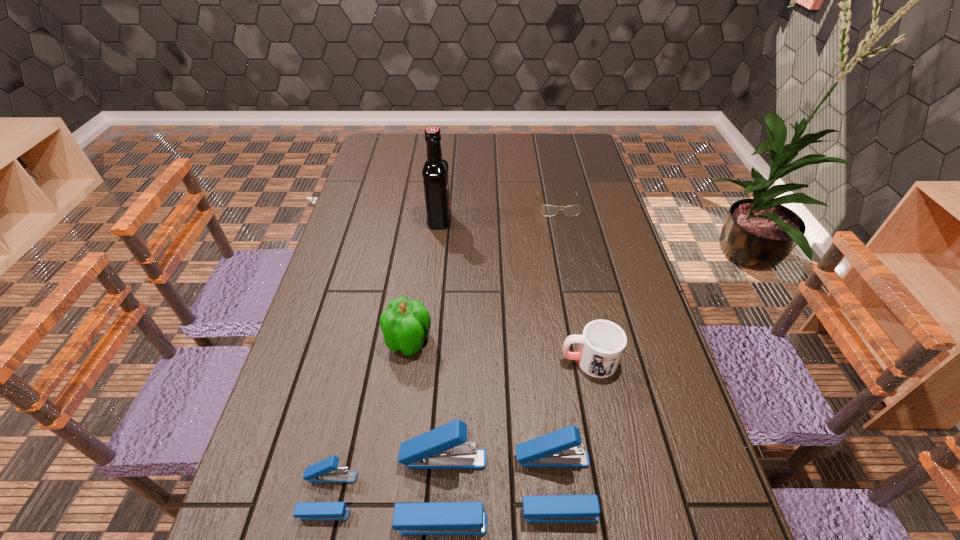
You are a GUI agent. You are given a task and a screenshot of the screen. Output one action in this format:
    pyautogui.click(x=<x>, y=<y>)
    Task: Click on the stapler that is the second closest to the second shortest stapler
    
    Given the screenshot: What is the action you would take?
    pyautogui.click(x=325, y=471)

Identify the location of free space that satisfies the following two spatial constraints: 1. on the front-facing side of the tallest object; 2. on the front side of the bell pepper. Image resolution: width=960 pixels, height=540 pixels. (427, 341).

You are a GUI agent. You are given a task and a screenshot of the screen. Output one action in this format:
    pyautogui.click(x=<x>, y=<y>)
    Task: Click on the blank area in the image that satisfies the following two spatial constraints: 1. on the front-facing side of the liquor; 2. on the right side of the second stapler from left to right
    The width and height of the screenshot is (960, 540).
    Given the screenshot: What is the action you would take?
    pyautogui.click(x=411, y=490)

Find the location of `free space that satisfies the following two spatial constraints: 1. on the back side of the second stapler from right to left; 2. on the front-facing side of the tallest object`. free space that satisfies the following two spatial constraints: 1. on the back side of the second stapler from right to left; 2. on the front-facing side of the tallest object is located at coordinates (458, 221).

This screenshot has width=960, height=540. In order to click on vacant space that satisfies the following two spatial constraints: 1. on the front side of the bell pepper; 2. on the right side of the second stapler from left to right in this screenshot , I will do `click(388, 490)`.